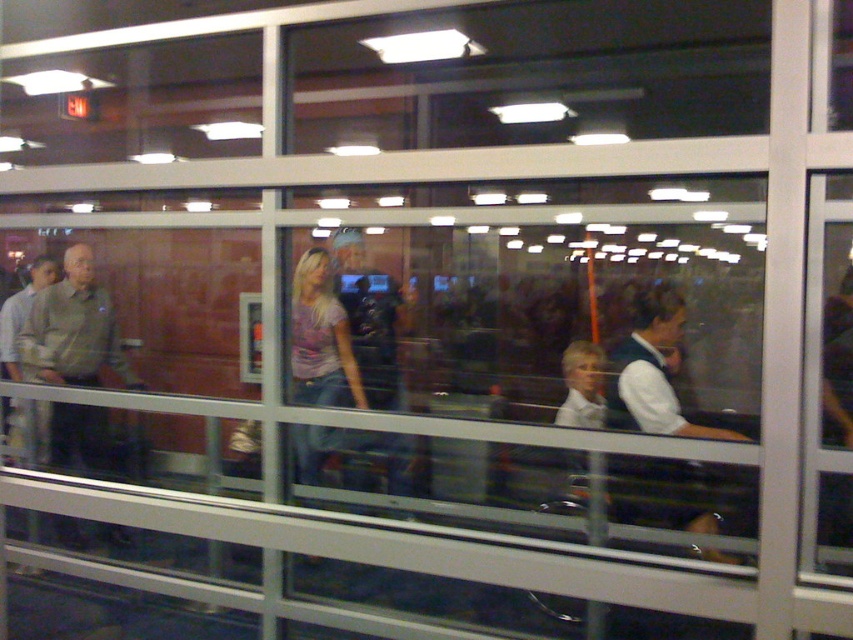
Is white shirt at center bigger than matte purple shirt at center?

Correct, white shirt at center is larger in size than matte purple shirt at center.

Is the position of white shirt at center more distant than that of matte purple shirt at center?

No.

Which is in front, point (628, 396) or point (314, 477)?

Positioned in front is point (628, 396).

You are a GUI agent. You are given a task and a screenshot of the screen. Output one action in this format:
    pyautogui.click(x=<x>, y=<y>)
    Task: Click on the white shirt at center
    The height and width of the screenshot is (640, 853).
    Given the screenshot: What is the action you would take?
    click(x=653, y=371)

Which is in front, point (91, 429) or point (639, 392)?

Point (639, 392) is in front.

Where is `matte gray shirt at left`? The image size is (853, 640). matte gray shirt at left is located at coordinates (73, 330).

Who is shorter, matte gray shirt at left or matte purple shirt at center?

Standing shorter between the two is matte purple shirt at center.

Which is in front, point (97, 470) or point (299, 388)?

Point (299, 388) is in front.

This screenshot has height=640, width=853. Identify the location of matte gray shirt at left. (73, 330).